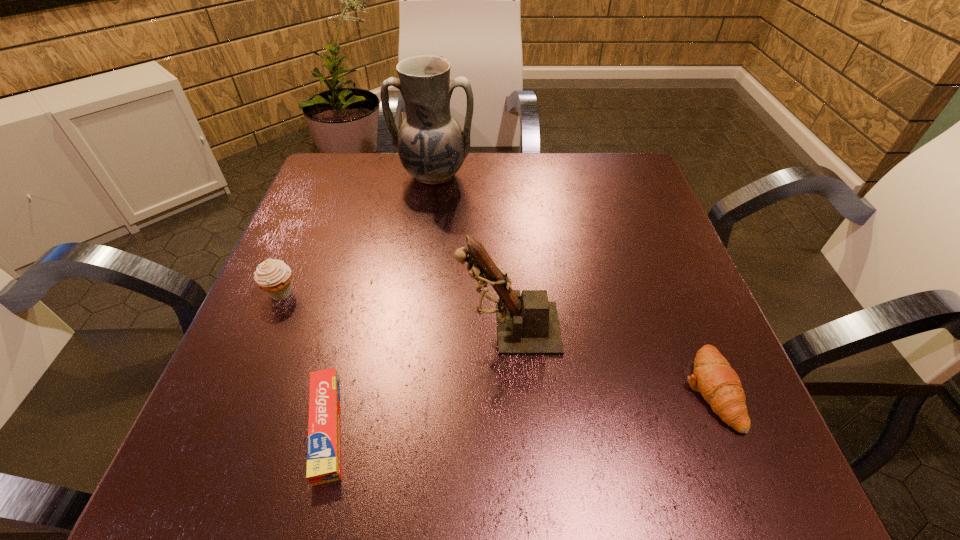
Image resolution: width=960 pixels, height=540 pixels. I want to click on the farthest object, so click(x=432, y=147).

Identify the location of pitcher. This screenshot has width=960, height=540. coord(432,147).

The width and height of the screenshot is (960, 540). Find the location of `the fourth shortest object`. the fourth shortest object is located at coordinates (528, 324).

The height and width of the screenshot is (540, 960). I want to click on the third shortest object, so click(273, 276).

This screenshot has height=540, width=960. What are the coordinates of `muffin` in the screenshot? It's located at (273, 276).

At what (x,y) coordinates should I click in order to perform the action: click on crescent roll. Please return your answer as a coordinate pair (x, y). Looking at the image, I should click on (719, 384).

Identify the location of the fourth tallest object. (719, 384).

Locate an element on the screen. toothpaste is located at coordinates (323, 451).

Where is `vacant space situated on the front-facing side of the farthest object`? Image resolution: width=960 pixels, height=540 pixels. vacant space situated on the front-facing side of the farthest object is located at coordinates (415, 317).

You are a GUI agent. You are given a task and a screenshot of the screen. Output one action in this format:
    pyautogui.click(x=<x>, y=<y>)
    Task: Click on the free spot located on the front-facing side of the figurine
    Image resolution: width=960 pixels, height=540 pixels.
    Given the screenshot: What is the action you would take?
    pyautogui.click(x=255, y=328)